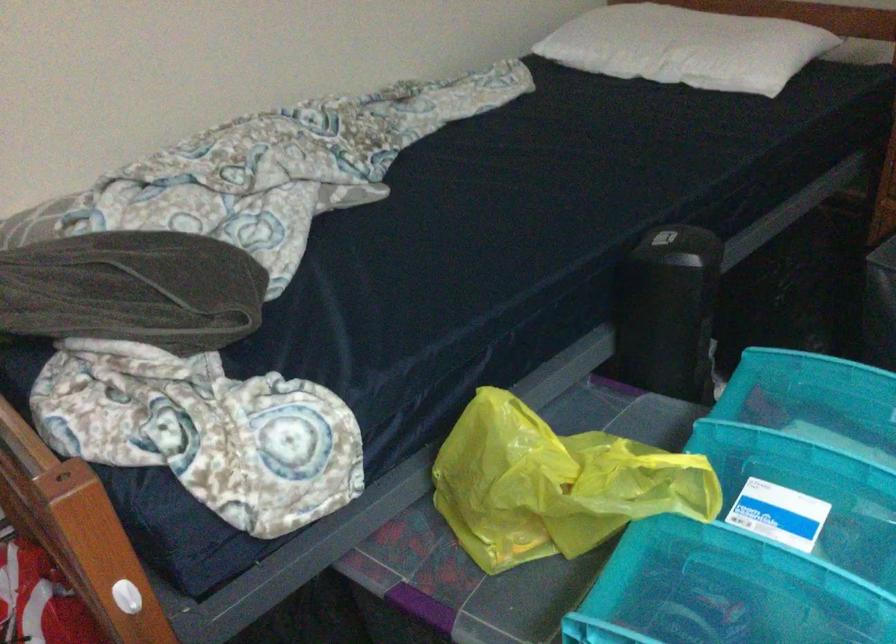
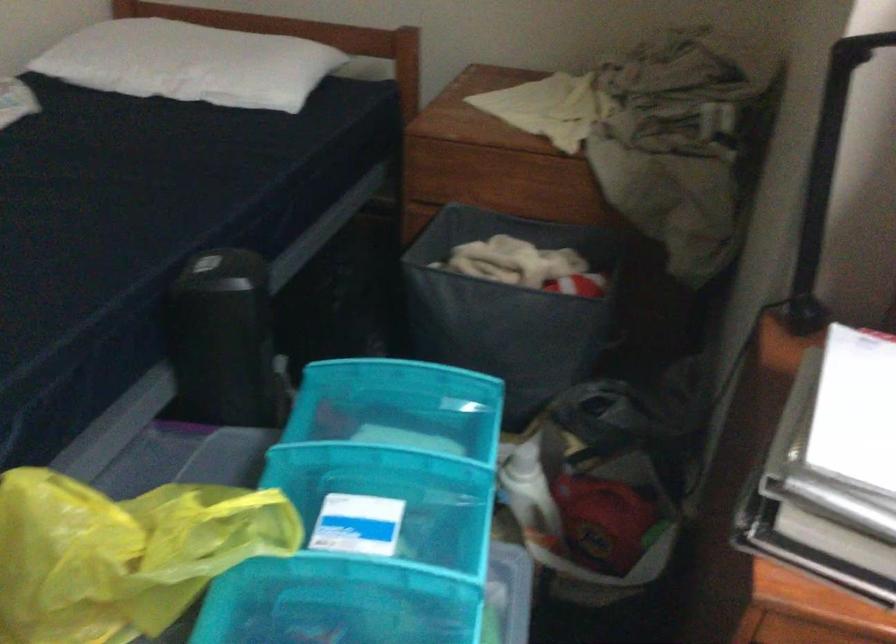
The point at (556,480) is marked in the first image. Where is the corresponding point in the second image?

(122, 554)